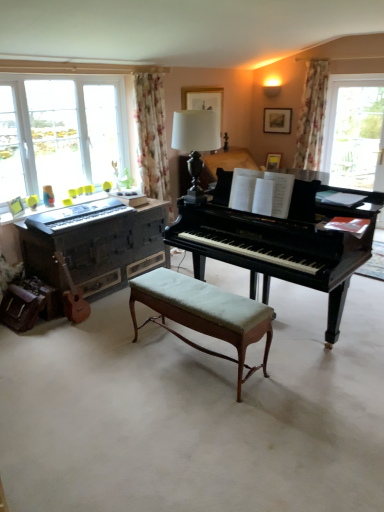
You are a GUI agent. You are given a task and a screenshot of the screen. Output one action in this format:
    pyautogui.click(x=<x>, y=<y>)
    Task: Click on the white glossy table lamp at center
    The image size is (384, 512).
    Given the screenshot: What is the action you would take?
    pyautogui.click(x=195, y=143)

The image size is (384, 512). In order to click on wooden acoustic guitar at lower left in this screenshot , I will do `click(72, 295)`.

At what (x,y) coordinates should I click in order to perform the action: click on table lamp above the wooden piano at left, the second piano positioned from the right (from a real-world perspective). Please return your answer as a coordinate pair (x, y). This screenshot has height=512, width=384. Looking at the image, I should click on (195, 143).

Measure the distance between white glossy table lamp at center and wooden piano at left, the second piano positioned from the right.

The distance of white glossy table lamp at center from wooden piano at left, the second piano positioned from the right, is 3.95 feet.

Does white glossy table lamp at center turn towards wooden piano at left, the second piano positioned from the right?

No, white glossy table lamp at center is not aimed at wooden piano at left, the second piano positioned from the right.

Which is behind, point (199, 189) or point (78, 225)?

The point (199, 189) is farther.

Does point (75, 312) appear closer or farther from the camera than point (304, 213)?

Point (75, 312) is positioned farther from the camera compared to point (304, 213).

Is wooden acoustic guitar at lower left wider or thinner than black polished wood piano at center, acting as the first piano starting from the right?

Clearly, wooden acoustic guitar at lower left has less width compared to black polished wood piano at center, acting as the first piano starting from the right.

Is wooden acoustic guitar at lower left facing towards black polished wood piano at center, acting as the first piano starting from the right?

No, wooden acoustic guitar at lower left is not oriented towards black polished wood piano at center, acting as the first piano starting from the right.

I want to click on table in front of the wooden acoustic guitar at lower left, so click(x=204, y=313).

Can you confirm if wooden acoustic guitar at lower left is thinner than light green upholstered bench at center?

Yes, wooden acoustic guitar at lower left is thinner than light green upholstered bench at center.

From a real-world perspective, is wooden acoustic guitar at lower left positioned above or below light green upholstered bench at center?

wooden acoustic guitar at lower left is above light green upholstered bench at center.

Considering the relative positions of wooden acoustic guitar at lower left and light green upholstered bench at center in the image provided, is wooden acoustic guitar at lower left behind light green upholstered bench at center?

Yes, it is behind light green upholstered bench at center.

Is wooden piano at left, the 1th piano viewed from the left, surrounding white glossy table lamp at center?

→ That's incorrect, white glossy table lamp at center is not inside wooden piano at left, the 1th piano viewed from the left.

Where is `piano that is the 2nd object directly below the white glossy table lamp at center (from a real-world perspective)`? piano that is the 2nd object directly below the white glossy table lamp at center (from a real-world perspective) is located at coordinates (96, 244).

From the image's perspective, would you say wooden piano at left, the 1th piano viewed from the left, is shown under white glossy table lamp at center?

Yes, from the image's perspective, wooden piano at left, the 1th piano viewed from the left, is below white glossy table lamp at center.

Considering the sizes of wooden piano at left, the second piano positioned from the right, and white glossy table lamp at center in the image, is wooden piano at left, the second piano positioned from the right, taller or shorter than white glossy table lamp at center?

In the image, wooden piano at left, the second piano positioned from the right, appears to be taller than white glossy table lamp at center.

Locate an element on the screen. The height and width of the screenshot is (512, 384). curtain above the white glossy table lamp at center (from a real-world perspective) is located at coordinates (312, 115).

Based on the photo, which of these two, white glossy table lamp at center or floral fabric curtain at upper right, stands taller?

Standing taller between the two is floral fabric curtain at upper right.

From the image's perspective, who appears lower, white glossy table lamp at center or floral fabric curtain at upper right?

white glossy table lamp at center appears lower in the image.

In the scene shown: Between white glossy table lamp at center and floral fabric curtain at upper right, which one has smaller size?

With smaller size is white glossy table lamp at center.

Do you think light green upholstered bench at center is within matte black keyboard at left, or outside of it?

light green upholstered bench at center cannot be found inside matte black keyboard at left.

Is matte black keyboard at left at the back of light green upholstered bench at center?

No, light green upholstered bench at center's orientation is not away from matte black keyboard at left.

Considering the relative sizes of white glossy table lamp at center and black polished wood piano at center, which appears as the 2th piano when viewed from the left, in the image provided, is white glossy table lamp at center taller than black polished wood piano at center, which appears as the 2th piano when viewed from the left,?

Incorrect, the height of white glossy table lamp at center is not larger of that of black polished wood piano at center, which appears as the 2th piano when viewed from the left.

Does white glossy table lamp at center turn towards black polished wood piano at center, acting as the first piano starting from the right?

No, white glossy table lamp at center does not turn towards black polished wood piano at center, acting as the first piano starting from the right.

Considering the relative sizes of white glossy table lamp at center and black polished wood piano at center, acting as the first piano starting from the right, in the image provided, is white glossy table lamp at center bigger than black polished wood piano at center, acting as the first piano starting from the right,?

Actually, white glossy table lamp at center might be smaller than black polished wood piano at center, acting as the first piano starting from the right.

What are the coordinates of `piano on the left of the white glossy table lamp at center` in the screenshot? It's located at (96, 244).

The image size is (384, 512). In order to click on instrument beneath the black polished wood piano at center, acting as the first piano starting from the right (from a real-world perspective) in this screenshot , I will do `click(72, 295)`.

Based on their spatial positions, is floral fabric curtain at upper right or black polished wood piano at center, acting as the first piano starting from the right, further from light green upholstered bench at center?

floral fabric curtain at upper right lies further to light green upholstered bench at center than the other object.

Considering their positions, is floral fabric curtain at upper right positioned closer to wooden piano at left, the second piano positioned from the right, than matte black keyboard at left?

matte black keyboard at left is positioned closer to the anchor wooden piano at left, the second piano positioned from the right.

Which object lies further to the anchor point matte black keyboard at left, wooden acoustic guitar at lower left or light green upholstered bench at center?

light green upholstered bench at center is further to matte black keyboard at left.

Based on their spatial positions, is wooden piano at left, the second piano positioned from the right, or light green upholstered bench at center closer to wooden acoustic guitar at lower left?

The object closer to wooden acoustic guitar at lower left is wooden piano at left, the second piano positioned from the right.

Which object lies further to the anchor point wooden acoustic guitar at lower left, wooden piano at left, the second piano positioned from the right, or matte black keyboard at left?

Based on the image, matte black keyboard at left appears to be further to wooden acoustic guitar at lower left.

Looking at the image, which one is located further to light green upholstered bench at center, matte black keyboard at left or white glossy table lamp at center?

Based on the image, matte black keyboard at left appears to be further to light green upholstered bench at center.

Which object lies nearer to the anchor point wooden piano at left, the 1th piano viewed from the left, light green upholstered bench at center or white glossy table lamp at center?

light green upholstered bench at center is positioned closer to the anchor wooden piano at left, the 1th piano viewed from the left.

From the picture: When comparing their distances from wooden acoustic guitar at lower left, does black polished wood piano at center, which appears as the 2th piano when viewed from the left, or floral fabric curtain at upper right seem further?

Among the two, floral fabric curtain at upper right is located further to wooden acoustic guitar at lower left.

This screenshot has width=384, height=512. I want to click on piano between black polished wood piano at center, which appears as the 2th piano when viewed from the left, and floral fabric curtain at upper right, along the z-axis, so click(x=96, y=244).

The width and height of the screenshot is (384, 512). What are the coordinates of `musical keyboard located between light green upholstered bench at center and floral fabric curtain at upper right in the depth direction` in the screenshot? It's located at (76, 215).

Where is `table lamp situated between wooden acoustic guitar at lower left and floral fabric curtain at upper right from left to right`? The width and height of the screenshot is (384, 512). table lamp situated between wooden acoustic guitar at lower left and floral fabric curtain at upper right from left to right is located at coordinates (195, 143).

Locate an element on the screen. musical keyboard situated between wooden acoustic guitar at lower left and white glossy table lamp at center from left to right is located at coordinates (76, 215).